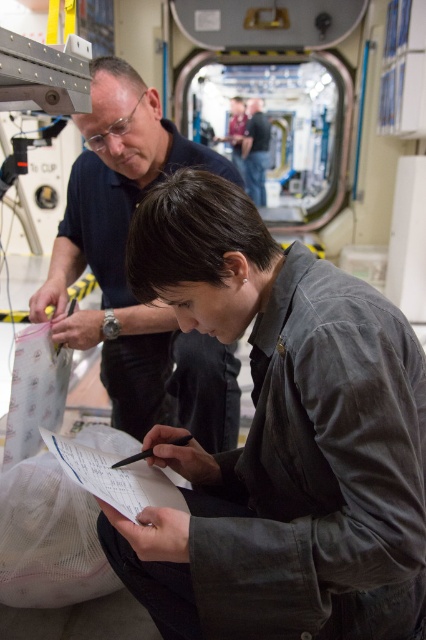
Which is more to the right, white paper at center or dark blue shirt at center?

From the viewer's perspective, dark blue shirt at center appears more on the right side.

The height and width of the screenshot is (640, 426). Find the location of `white paper at center`. white paper at center is located at coordinates (115, 476).

Does point (138, 486) come behind point (242, 148)?

No, (138, 486) is in front of (242, 148).

At what (x,y) coordinates should I click in order to perform the action: click on white paper at center. Please return your answer as a coordinate pair (x, y). Looking at the image, I should click on (115, 476).

Between point (250, 116) and point (189, 436), which one is positioned in front?

Point (189, 436) is more forward.

Which is behind, point (268, 129) or point (126, 460)?

The point (268, 129) is behind.

This screenshot has height=640, width=426. What do you see at coordinates (256, 150) in the screenshot?
I see `dark blue shirt at center` at bounding box center [256, 150].

In order to click on dark blue shirt at center in this screenshot , I will do `click(256, 150)`.

Can you confirm if dark gray uniform at center is thinner than dark blue shirt at center?

Incorrect, dark gray uniform at center's width is not less than dark blue shirt at center's.

Who is more distant from viewer, [336,625] or [245,160]?

The point [245,160] is more distant.

At what (x,y) coordinates should I click in order to perform the action: click on dark gray uniform at center. Please return your answer as a coordinate pair (x, y). Looking at the image, I should click on (281, 440).